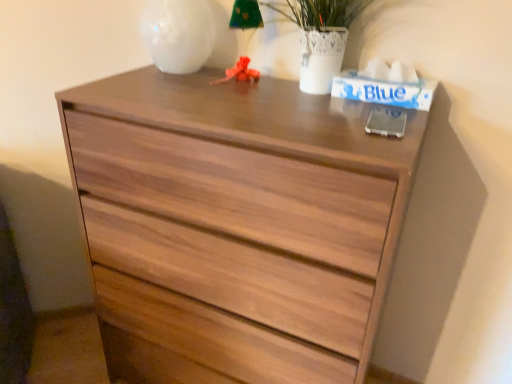
At what (x,y) coordinates should I click in order to perform the action: click on free space in front of matte white glass at upper center. Please return your answer as a coordinate pair (x, y). Looking at the image, I should click on (252, 104).